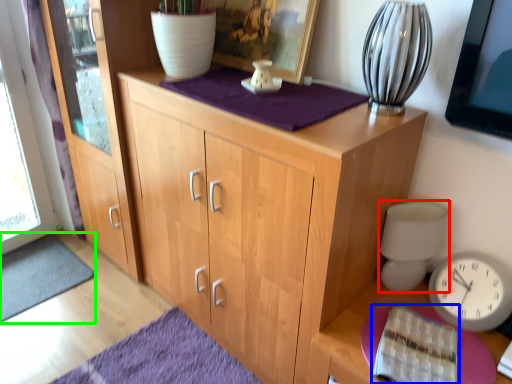
Question: Which object is positioned farthest from table lamp (highlighted by a red box)? Select from book (highlighted by a blue box) and doormat (highlighted by a green box).

Choices:
 (A) book
 (B) doormat

Answer: (B)